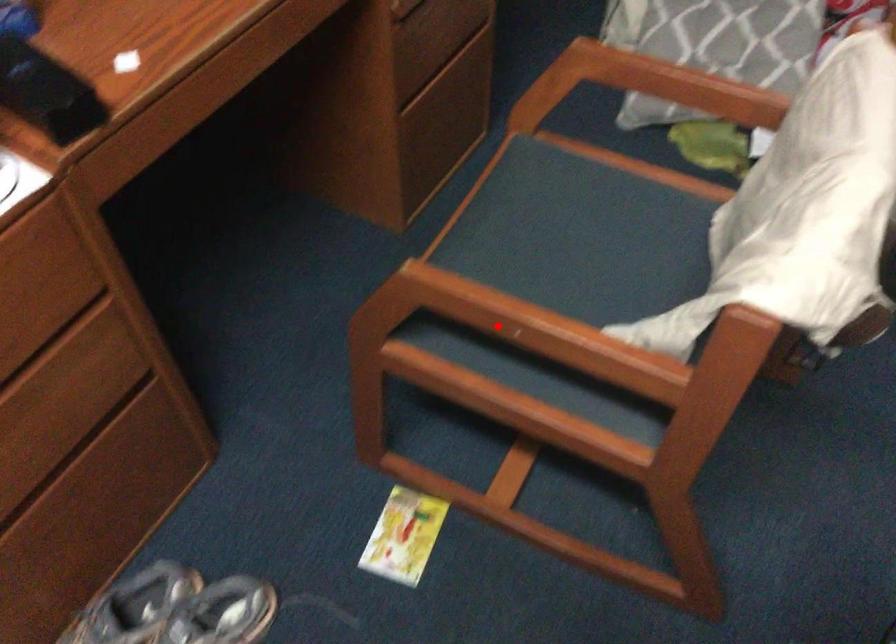
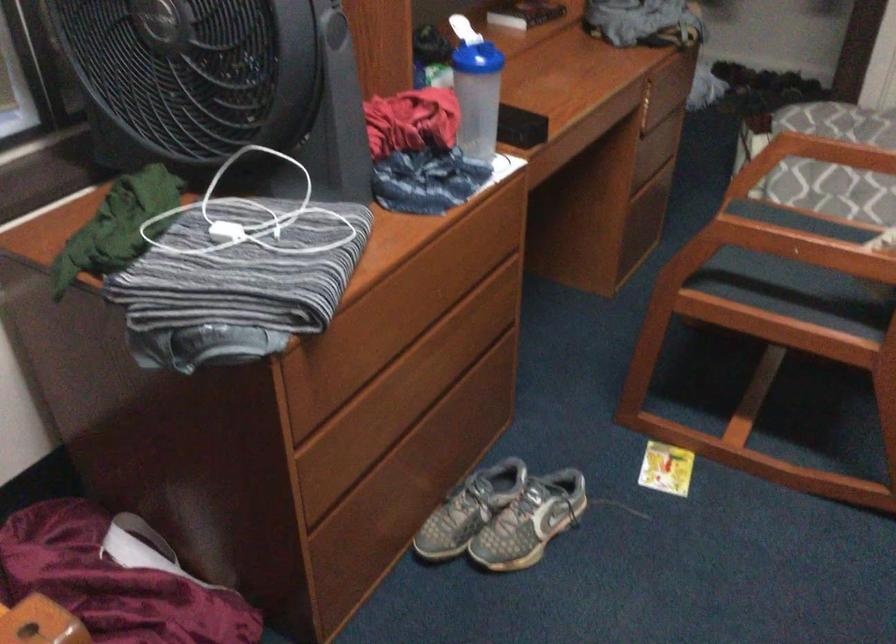
In the second image, find the point that corresponds to the highlighted location in the first image.

(790, 245)